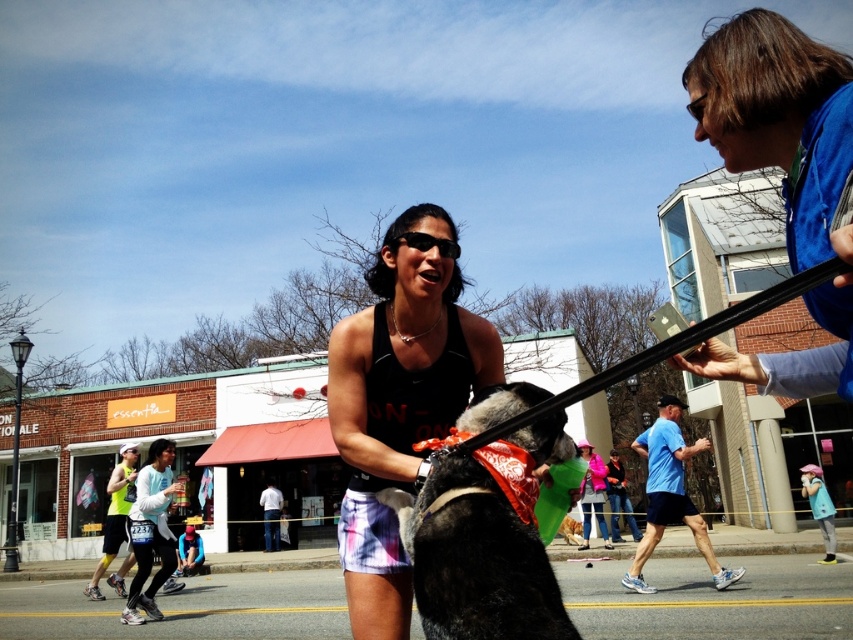
Is matte black tank top at center bigger than blue fabric at upper right?

Incorrect, matte black tank top at center is not larger than blue fabric at upper right.

Does matte black tank top at center appear under blue fabric at upper right?

Correct, matte black tank top at center is located below blue fabric at upper right.

Who is more distant from viewer, (x=430, y=310) or (x=821, y=150)?

Positioned behind is point (x=430, y=310).

Find the location of `matte black tank top at center`. matte black tank top at center is located at coordinates (399, 401).

Consider the image. Is blue fabric at upper right shorter than black fur dog at center?

No.

What do you see at coordinates (779, 120) in the screenshot?
I see `blue fabric at upper right` at bounding box center [779, 120].

What do you see at coordinates (779, 120) in the screenshot?
I see `blue fabric at upper right` at bounding box center [779, 120].

Identify the location of blue fabric at upper right. (779, 120).

Is matte black tank top at center wider than black fur dog at center?

Yes, matte black tank top at center is wider than black fur dog at center.

Does matte black tank top at center appear on the right side of black fur dog at center?

No, matte black tank top at center is not to the right of black fur dog at center.

Is point (440, 221) less distant than point (430, 538)?

No, it is behind (430, 538).

Image resolution: width=853 pixels, height=640 pixels. I want to click on matte black tank top at center, so click(x=399, y=401).